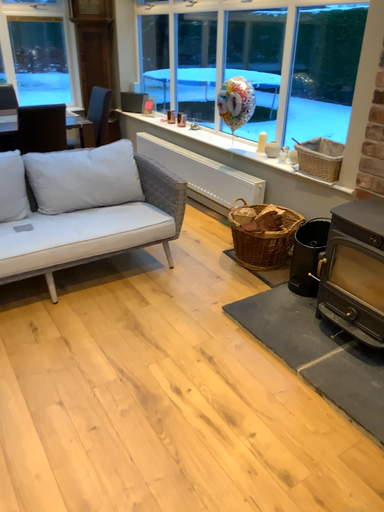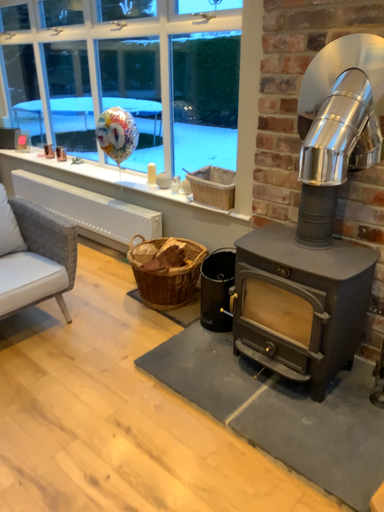
Question: Which way did the camera rotate in the video?

Choices:
 (A) rotated left
 (B) rotated right

Answer: (B)